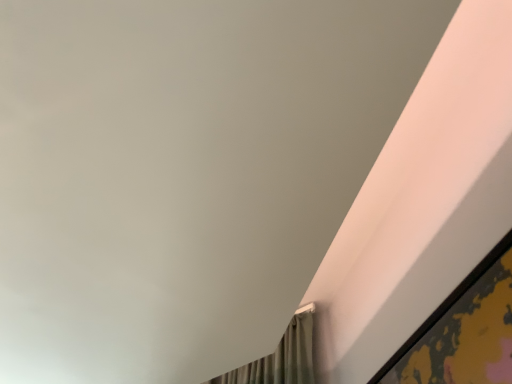
What do you see at coordinates (463, 331) in the screenshot?
I see `wooden frame at lower right` at bounding box center [463, 331].

Locate an element on the screen. This screenshot has width=512, height=384. wooden frame at lower right is located at coordinates (463, 331).

Where is `wooden frame at lower right`? This screenshot has width=512, height=384. wooden frame at lower right is located at coordinates (463, 331).